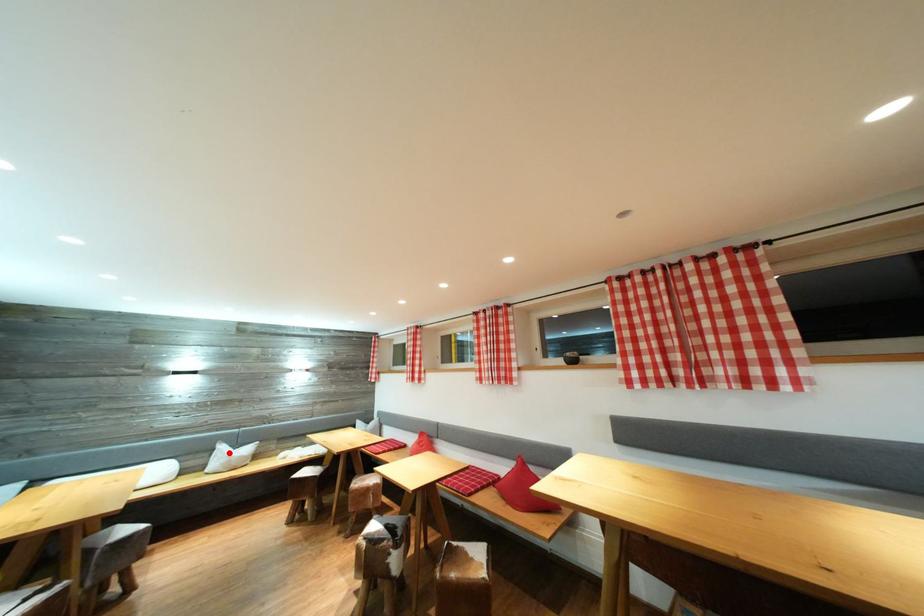
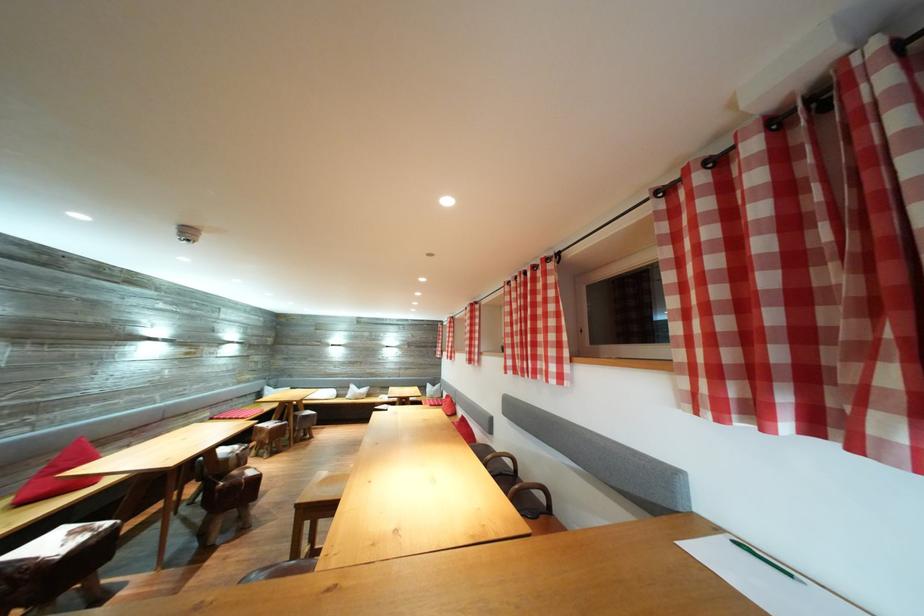
Where in the second image is the point corresponding to the highlighted location from the first image?

(359, 392)